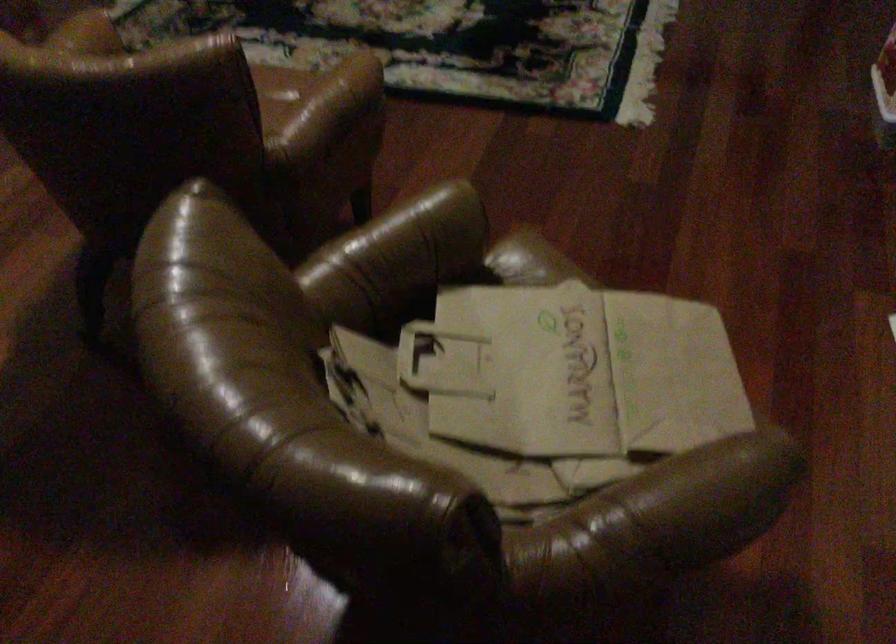
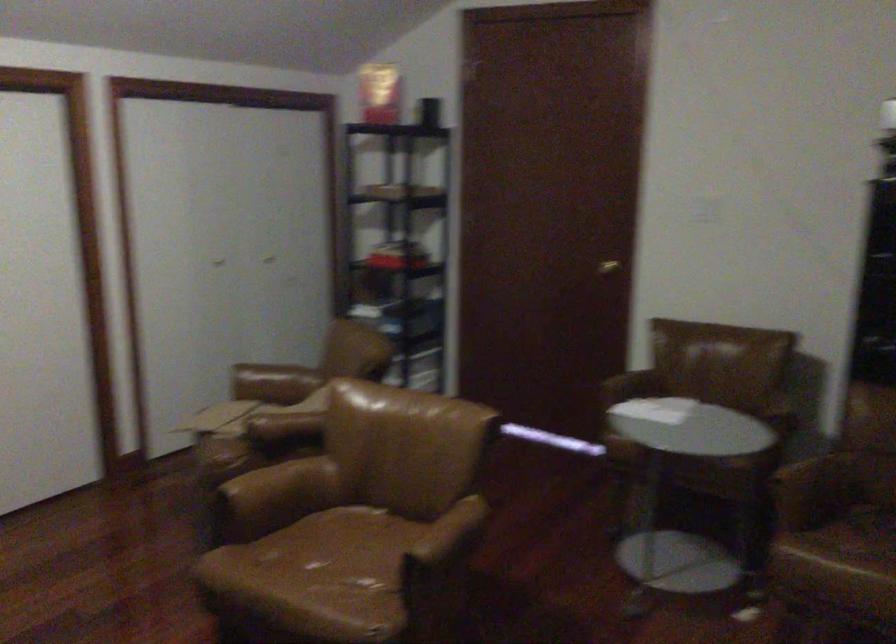
Where in the second image is the point corresponding to (x=633, y=552) from the first image?

(273, 383)